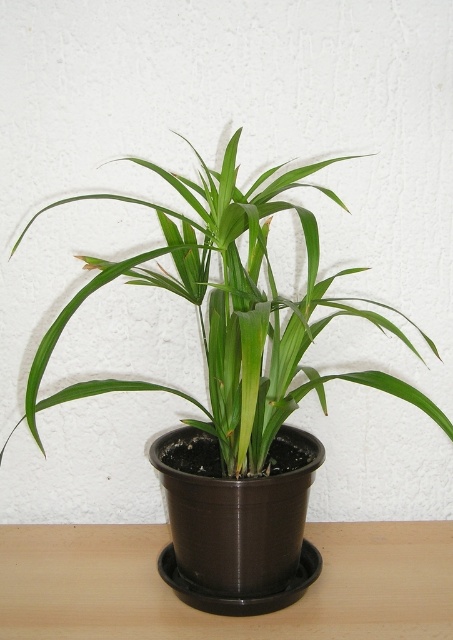
Which is behind, point (38, 216) or point (173, 604)?

The point (38, 216) is more distant.

Describe the element at coordinates (231, 308) in the screenshot. I see `green matte plant at center` at that location.

The height and width of the screenshot is (640, 453). I want to click on green matte plant at center, so click(x=231, y=308).